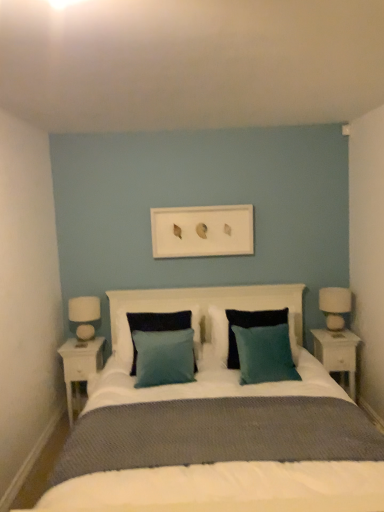
Question: Is teal fabric pillow at center, positioned as the 1th pillow in left-to-right order, at the right side of teal fabric pillow at center, the third pillow positioned from the left?

Choices:
 (A) yes
 (B) no

Answer: (B)

Question: From a real-world perspective, is teal fabric pillow at center, which is the 3th pillow in right-to-left order, positioned over teal fabric pillow at center, which ranks as the first pillow in right-to-left order, based on gravity?

Choices:
 (A) no
 (B) yes

Answer: (A)

Question: Is teal fabric pillow at center, positioned as the 1th pillow in left-to-right order, not close to teal fabric pillow at center, which ranks as the first pillow in right-to-left order?

Choices:
 (A) no
 (B) yes

Answer: (A)

Question: Is teal fabric pillow at center, which is the 3th pillow in right-to-left order, in front of teal fabric pillow at center, the third pillow positioned from the left?

Choices:
 (A) no
 (B) yes

Answer: (A)

Question: Is teal fabric pillow at center, which is the 3th pillow in right-to-left order, positioned beyond the bounds of teal fabric pillow at center, the third pillow positioned from the left?

Choices:
 (A) yes
 (B) no

Answer: (A)

Question: From a real-world perspective, relative to white wood nightstand at left, the 1th nightstand positioned from the left, is white matte picture frame at center vertically above or below?

Choices:
 (A) above
 (B) below

Answer: (A)

Question: Is white matte picture frame at center situated inside white wood nightstand at left, the 1th nightstand positioned from the left, or outside?

Choices:
 (A) outside
 (B) inside

Answer: (A)

Question: In the image, is white matte picture frame at center on the left side or the right side of white wood nightstand at left, acting as the 2th nightstand starting from the right?

Choices:
 (A) right
 (B) left

Answer: (A)

Question: Is white matte picture frame at center bigger or smaller than white wood nightstand at left, the 1th nightstand positioned from the left?

Choices:
 (A) big
 (B) small

Answer: (B)

Question: From a real-world perspective, is teal fabric pillow at center, which is the 3th pillow in right-to-left order, positioned above or below white wood nightstand at left, acting as the 2th nightstand starting from the right?

Choices:
 (A) below
 (B) above

Answer: (B)

Question: Considering the positions of teal fabric pillow at center, positioned as the 1th pillow in left-to-right order, and white wood nightstand at left, acting as the 2th nightstand starting from the right, in the image, is teal fabric pillow at center, positioned as the 1th pillow in left-to-right order, bigger or smaller than white wood nightstand at left, acting as the 2th nightstand starting from the right,?

Choices:
 (A) big
 (B) small

Answer: (A)

Question: In terms of width, does teal fabric pillow at center, positioned as the 1th pillow in left-to-right order, look wider or thinner when compared to white wood nightstand at left, acting as the 2th nightstand starting from the right?

Choices:
 (A) thin
 (B) wide

Answer: (B)

Question: From the image's perspective, relative to white wood nightstand at left, acting as the 2th nightstand starting from the right, is teal fabric pillow at center, positioned as the 1th pillow in left-to-right order, above or below?

Choices:
 (A) below
 (B) above

Answer: (B)

Question: From the image's perspective, is teal fabric pillow at center, which is the 3th pillow in right-to-left order, above or below teal fabric pillow at center, placed as the 2th pillow when sorted from right to left?

Choices:
 (A) above
 (B) below

Answer: (B)

Question: From a real-world perspective, is teal fabric pillow at center, positioned as the 1th pillow in left-to-right order, physically located above or below teal fabric pillow at center, which is the 2th pillow in left-to-right order?

Choices:
 (A) above
 (B) below

Answer: (B)